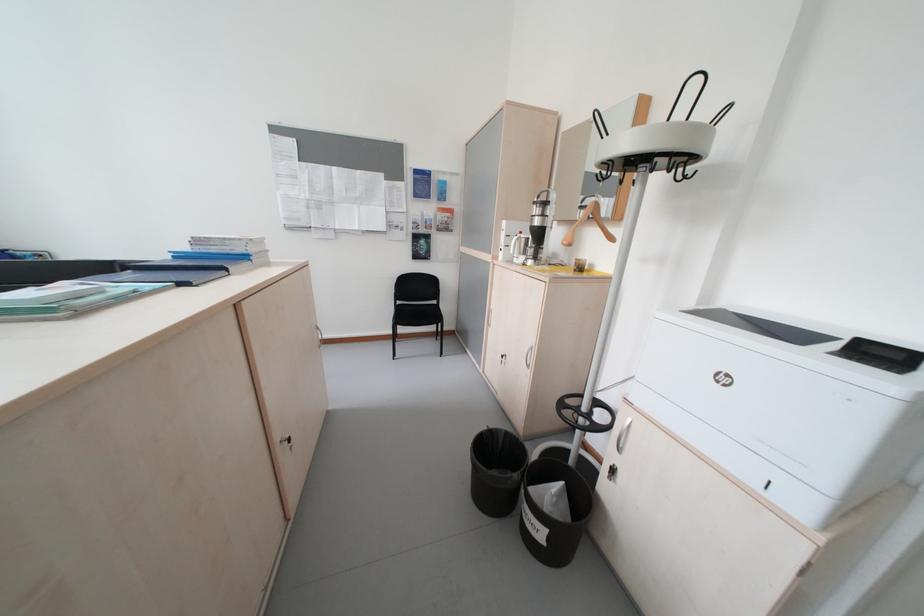
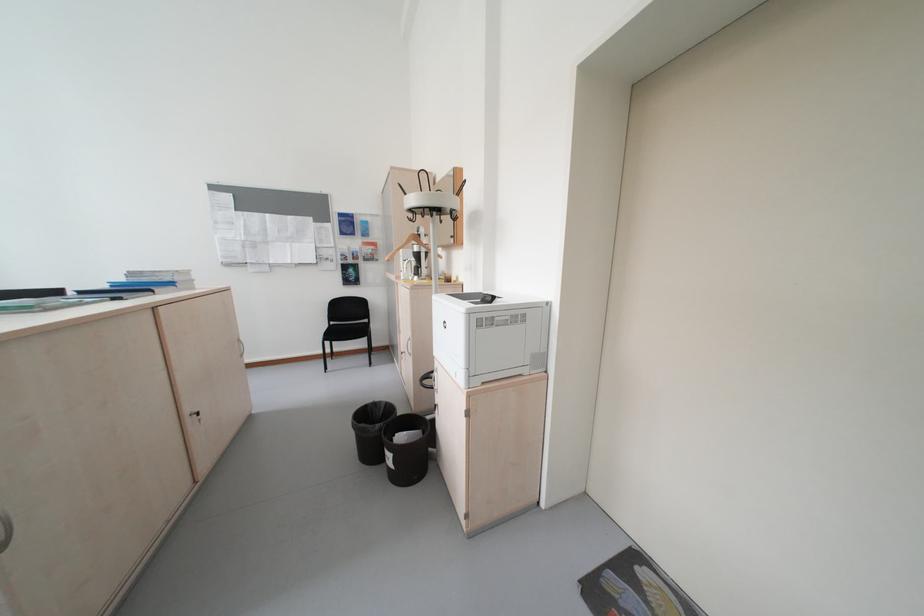
Question: How did the camera likely rotate?

Choices:
 (A) Left
 (B) Right
 (C) Up
 (D) Down

Answer: (C)